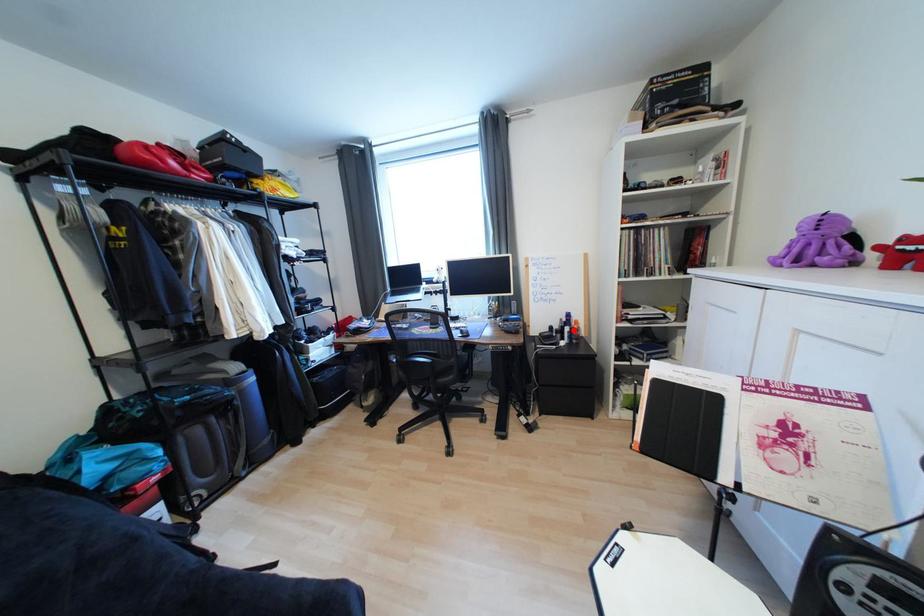
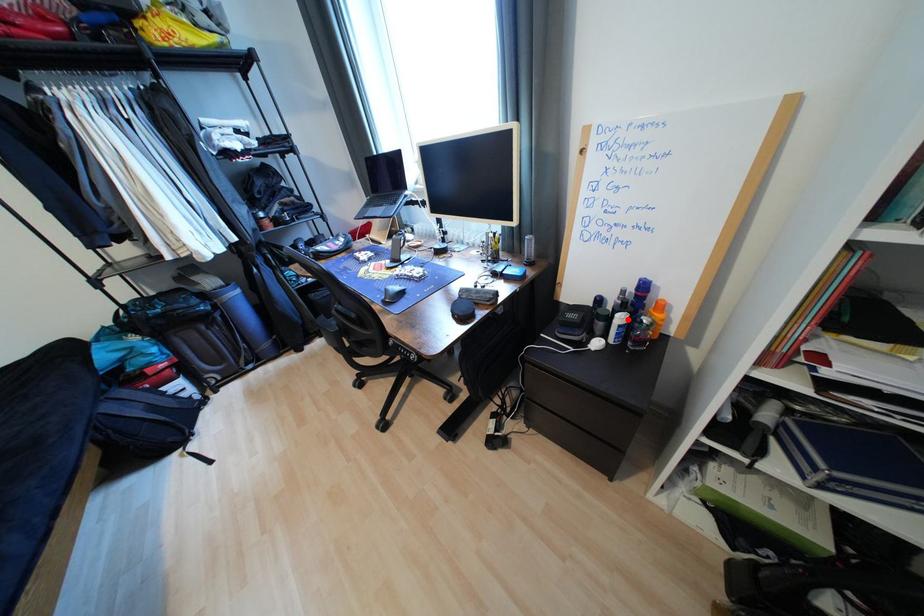
I am providing you with two images of the same scene from different viewpoints. A red point is marked on the first image and another point is marked on the second image. Are the points marked in image1 and image2 representing the same 3D position?

Yes